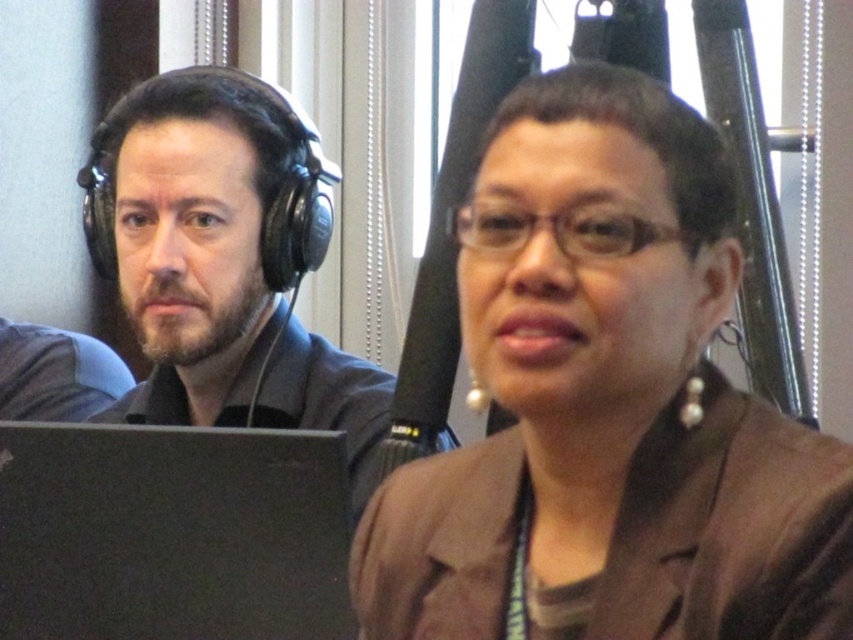
Question: Which object appears farthest from the camera in this image?

Choices:
 (A) black matte laptop at lower left
 (B) matte black headphones at left

Answer: (B)

Question: Is brown fabric jacket at center bigger than matte black headphones at left?

Choices:
 (A) no
 (B) yes

Answer: (A)

Question: Does brown fabric jacket at center appear on the left side of black matte laptop at lower left?

Choices:
 (A) yes
 (B) no

Answer: (B)

Question: Is matte black headphones at left further to camera compared to black matte laptop at lower left?

Choices:
 (A) no
 (B) yes

Answer: (B)

Question: Which point is closer to the camera?

Choices:
 (A) (633, 170)
 (B) (285, 211)
 (C) (202, 564)

Answer: (A)

Question: Which of these objects is positioned closest to the black matte laptop at lower left?

Choices:
 (A) brown fabric jacket at center
 (B) matte black headphones at left

Answer: (B)